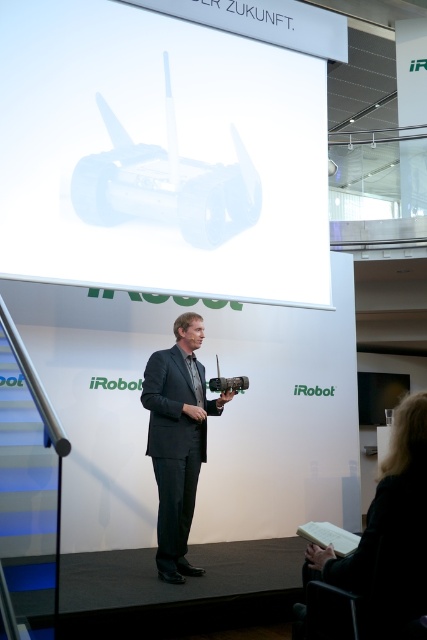
Is point (173, 100) more distant than point (184, 406)?

Yes, it is.

Looking at this image, between white glossy projector at upper center and dark gray suit at center, which one has less height?

With less height is dark gray suit at center.

You are a GUI agent. You are given a task and a screenshot of the screen. Output one action in this format:
    pyautogui.click(x=<x>, y=<y>)
    Task: Click on the white glossy projector at upper center
    
    Given the screenshot: What is the action you would take?
    pyautogui.click(x=160, y=156)

Where is `white glossy projector at upper center`? This screenshot has width=427, height=640. white glossy projector at upper center is located at coordinates (160, 156).